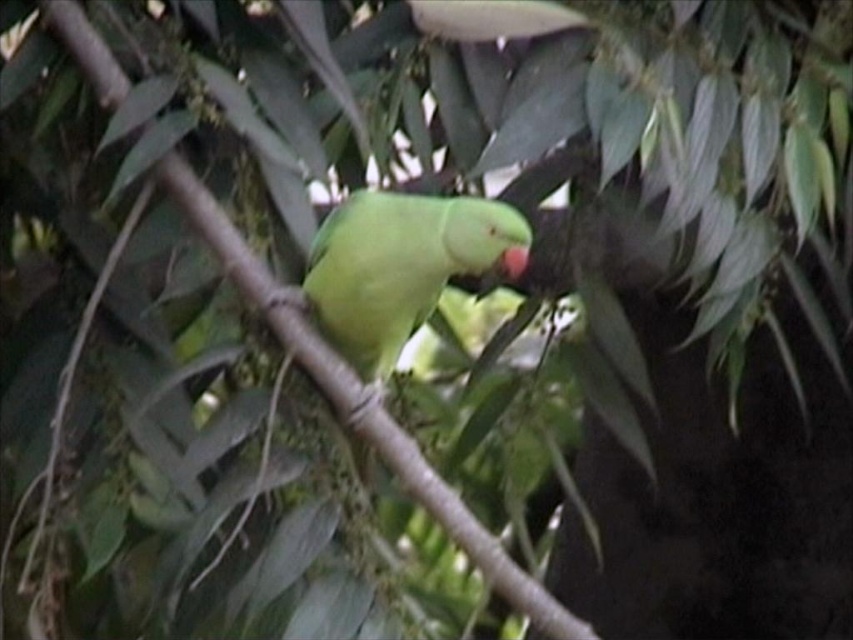
Is green matte parrot at center above green matte beak at center?

No, green matte parrot at center is not above green matte beak at center.

Who is positioned more to the left, green matte parrot at center or green matte beak at center?

Positioned to the left is green matte parrot at center.

Who is more forward, (498,264) or (503,262)?

Positioned in front is point (503,262).

You are a GUI agent. You are given a task and a screenshot of the screen. Output one action in this format:
    pyautogui.click(x=<x>, y=<y>)
    Task: Click on the green matte parrot at center
    
    Given the screenshot: What is the action you would take?
    pyautogui.click(x=396, y=268)